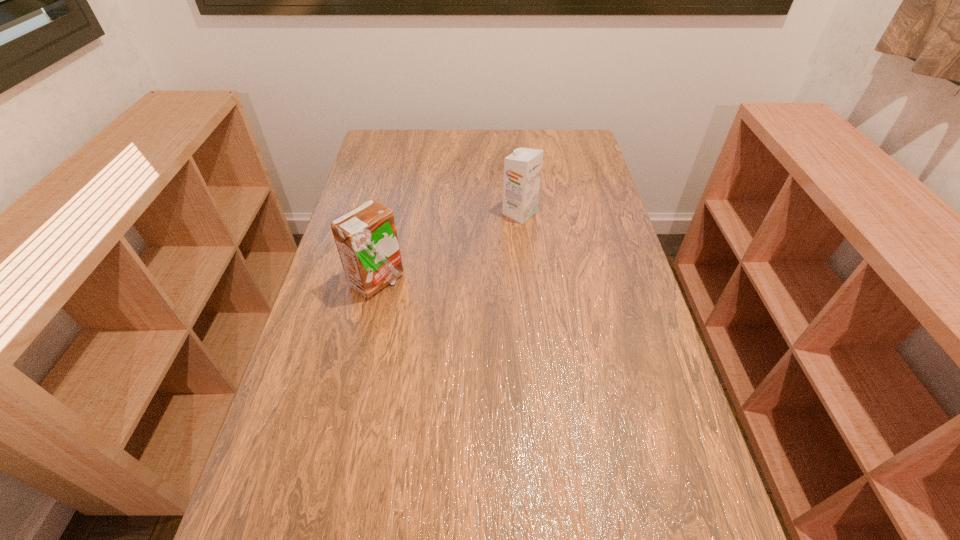
Find the location of a particular element. free location at the far left corner of the desktop is located at coordinates (394, 142).

What are the coordinates of `free space at the far right corner of the desktop` in the screenshot? It's located at (553, 138).

Locate an element on the screen. unoccupied area between the farther carton and the nearer carton is located at coordinates (448, 247).

Identify the location of free space between the left carton and the farther object. (448, 247).

Locate an element on the screen. This screenshot has height=540, width=960. vacant point located between the left carton and the right object is located at coordinates [448, 247].

Find the location of `free space between the right object and the left carton`. free space between the right object and the left carton is located at coordinates 448,247.

Identify the location of free point between the farther carton and the left carton. (448, 247).